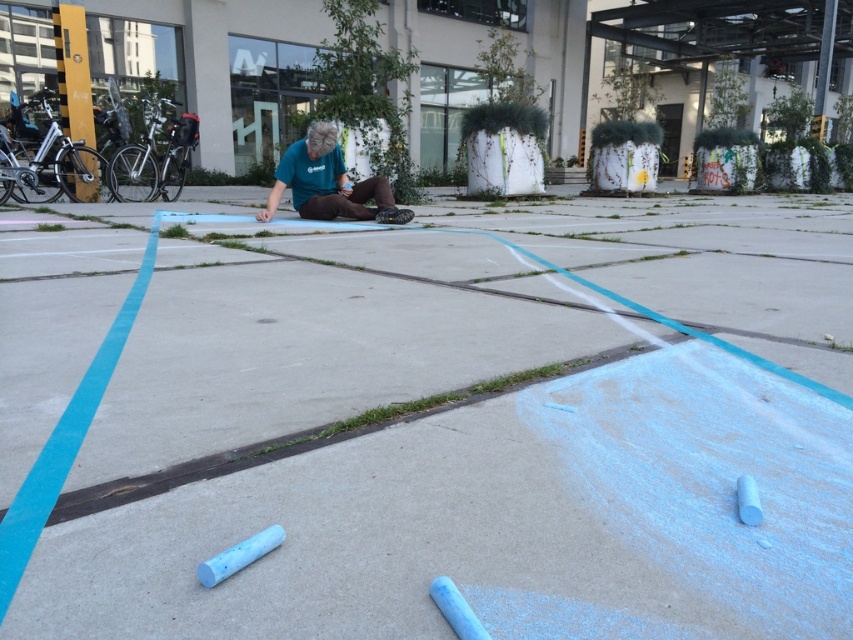
You are standing in the urban setting depicted. You want to place a small potted plant between you and the smooth concrete pavement at center. Is there enough space to do so?

The distance between you and the smooth concrete pavement at center is 4.48 feet, so yes, there is enough space to place a small potted plant between you and the smooth concrete pavement at center.

You are a passerby who wants to take a photo of the scene. You notice the smooth concrete pavement at center and the teal fabric shirt at center. Which object is wider when viewed from above?

The smooth concrete pavement at center is wider than the teal fabric shirt at center.

You are a pedestrian walking past the scene. You notice the smooth concrete pavement at center and the teal fabric shirt at center. Which object is positioned lower in the image?

Result: The smooth concrete pavement at center is located below the teal fabric shirt at center, so it is positioned lower in the image.